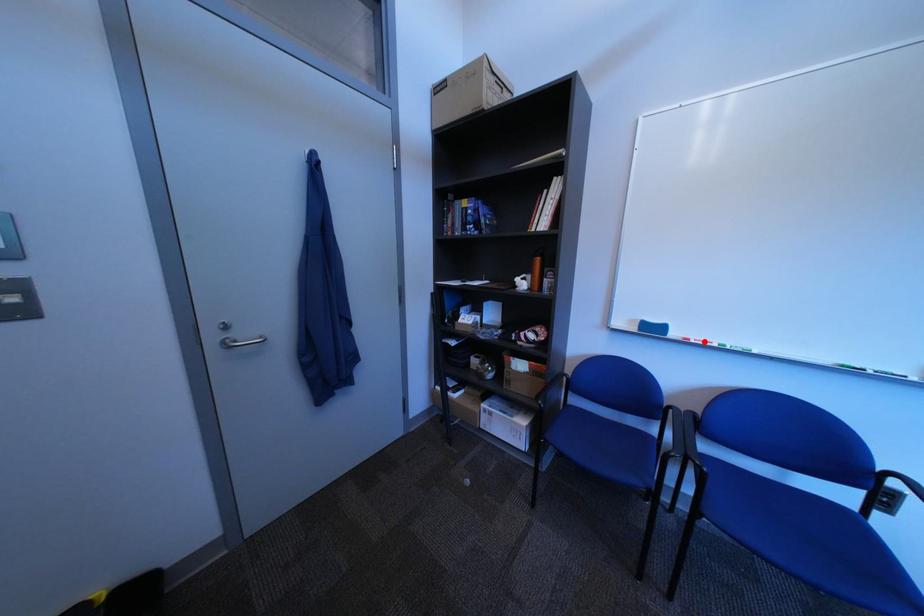
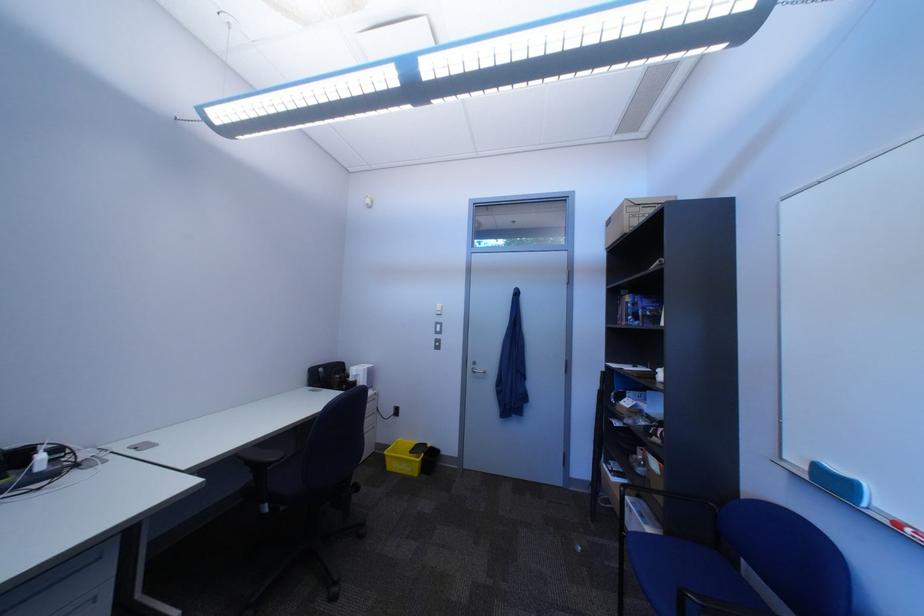
The point at the highlighted location is marked in the first image. Where is the corresponding point in the second image?

(915, 527)